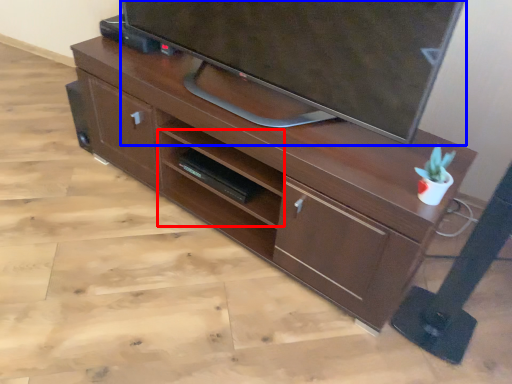
Question: Among these objects, which one is farthest to the camera, shelf (highlighted by a red box) or television (highlighted by a blue box)?

Choices:
 (A) shelf
 (B) television

Answer: (A)